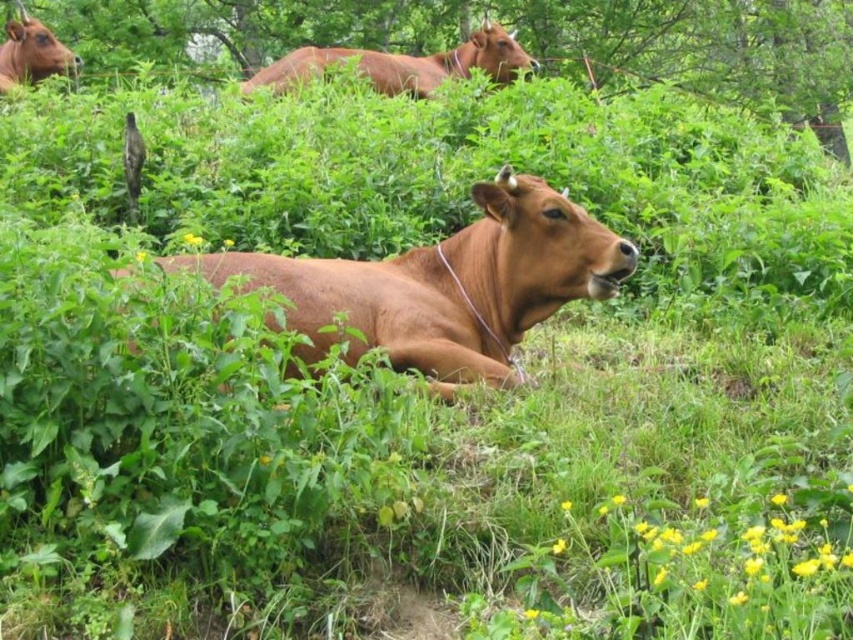
Question: Which object is farther from the camera taking this photo?

Choices:
 (A) brown smooth cow at upper center
 (B) matte brown cow at upper left
 (C) green leafy tree at upper center

Answer: (C)

Question: Does green leafy tree at upper center appear on the right side of matte brown cow at upper left?

Choices:
 (A) no
 (B) yes

Answer: (B)

Question: Which point is farther to the camera?

Choices:
 (A) (77, 67)
 (B) (498, 35)
 (C) (381, 346)

Answer: (B)

Question: Which of the following is the farthest from the observer?

Choices:
 (A) (480, 38)
 (B) (12, 36)
 (C) (405, 348)

Answer: (A)

Question: Does brown smooth cow at upper center have a larger size compared to matte brown cow at upper left?

Choices:
 (A) no
 (B) yes

Answer: (B)

Question: From the image, what is the correct spatial relationship of brown smooth cow at upper center in relation to matte brown cow at upper left?

Choices:
 (A) right
 (B) left

Answer: (A)